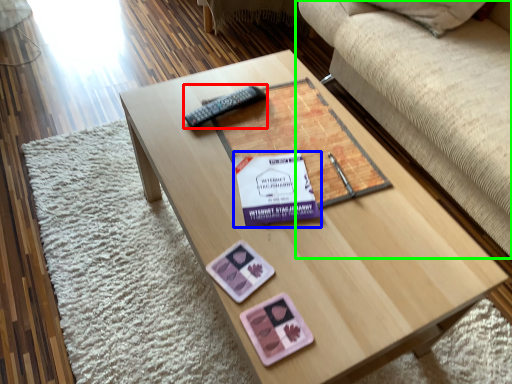
Question: Which is farther away from remote (highlighted by a red box)? paperback book (highlighted by a blue box) or studio couch (highlighted by a green box)?

Choices:
 (A) paperback book
 (B) studio couch

Answer: (B)